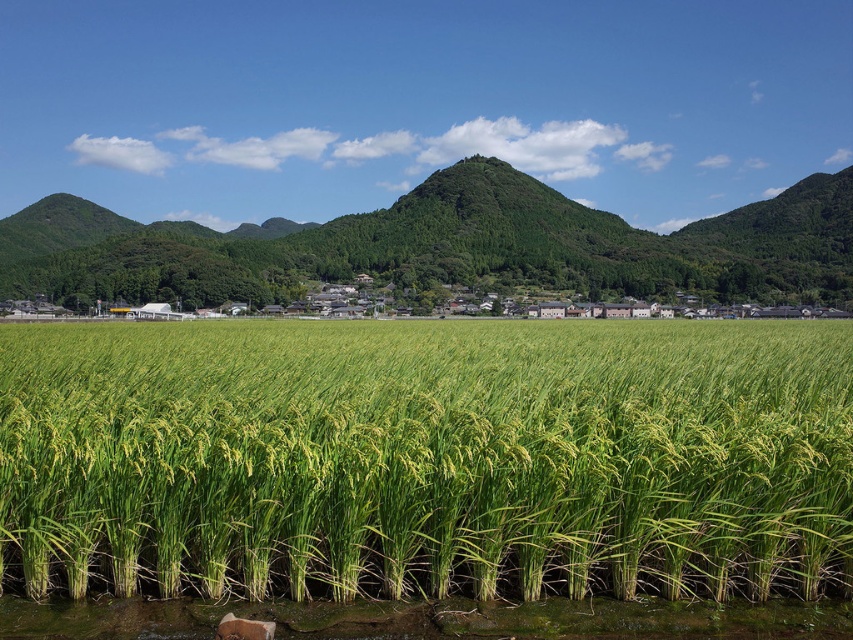
In the scene shown: Which is below, green grassy rice field at center or green grassy hill at center?

green grassy rice field at center

Can you confirm if green grassy rice field at center is smaller than green grassy hill at center?

Yes.

Between point (769, 390) and point (236, 260), which one is positioned in front?

Positioned in front is point (769, 390).

Locate an element on the screen. green grassy rice field at center is located at coordinates (426, 460).